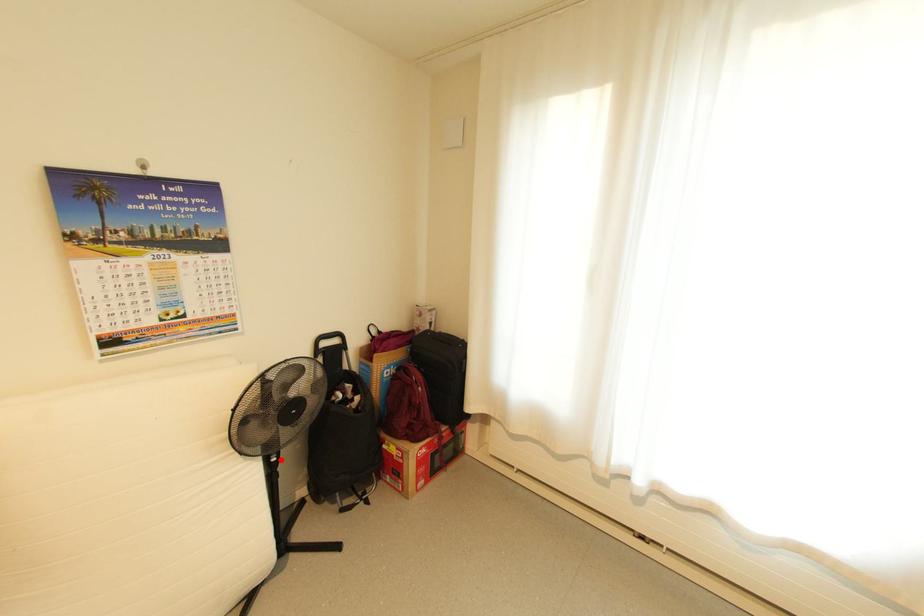
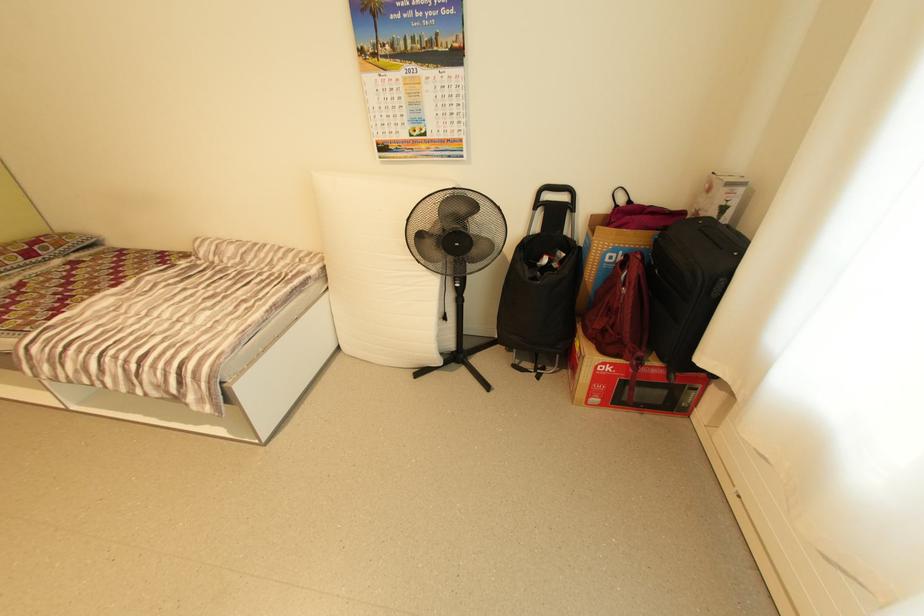
Question: I am providing you with two images of the same scene from different viewpoints. Given a red point in image1, look at the same physical point in image2. Is it:

Choices:
 (A) Closer to the viewpoint
 (B) Farther from the viewpoint

Answer: (B)